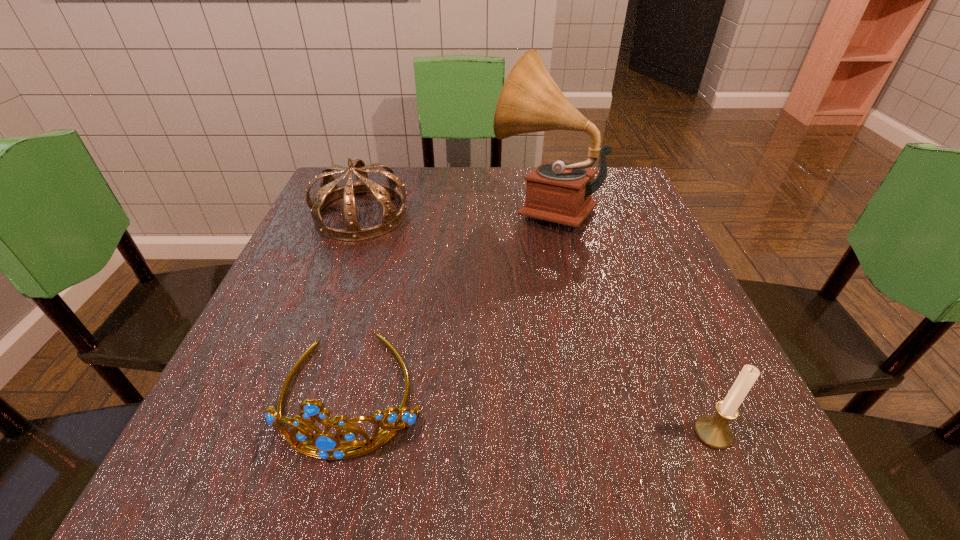
This screenshot has height=540, width=960. In the image, there is a desktop. Find the location of `vacant space at the far edge`. vacant space at the far edge is located at coordinates (425, 167).

In order to click on free space at the near edge in this screenshot , I will do `click(323, 486)`.

The image size is (960, 540). In order to click on vacant space at the left edge of the desktop in this screenshot , I will do [309, 391].

Locate an element on the screen. The height and width of the screenshot is (540, 960). vacant space at the right edge is located at coordinates (636, 276).

The image size is (960, 540). Identify the location of blank space at the far left corner of the desktop. (374, 175).

In order to click on free region at the far right corner of the desktop in this screenshot , I will do `click(621, 191)`.

Where is `vacant point located between the farther tiara and the rightmost object`? The image size is (960, 540). vacant point located between the farther tiara and the rightmost object is located at coordinates (x=537, y=324).

The image size is (960, 540). I want to click on empty location between the rightmost object and the farther tiara, so click(x=537, y=324).

Identify the location of free space between the second object from right to left and the farther tiara. (452, 210).

You are a GUI agent. You are given a task and a screenshot of the screen. Output one action in this format:
    pyautogui.click(x=<x>, y=<y>)
    Task: Click on the free space that is in between the nearer tiara and the candle holder
    
    Given the screenshot: What is the action you would take?
    pyautogui.click(x=532, y=413)